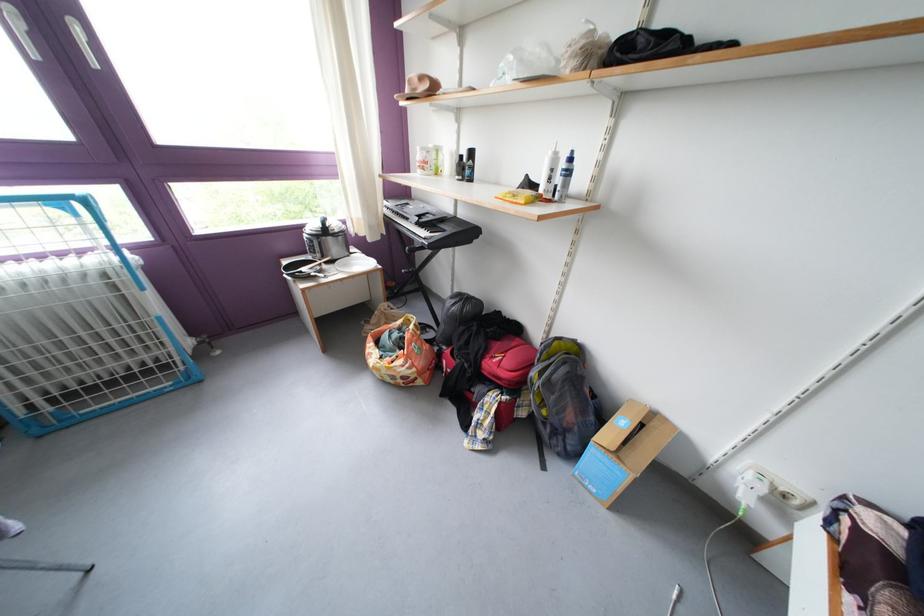
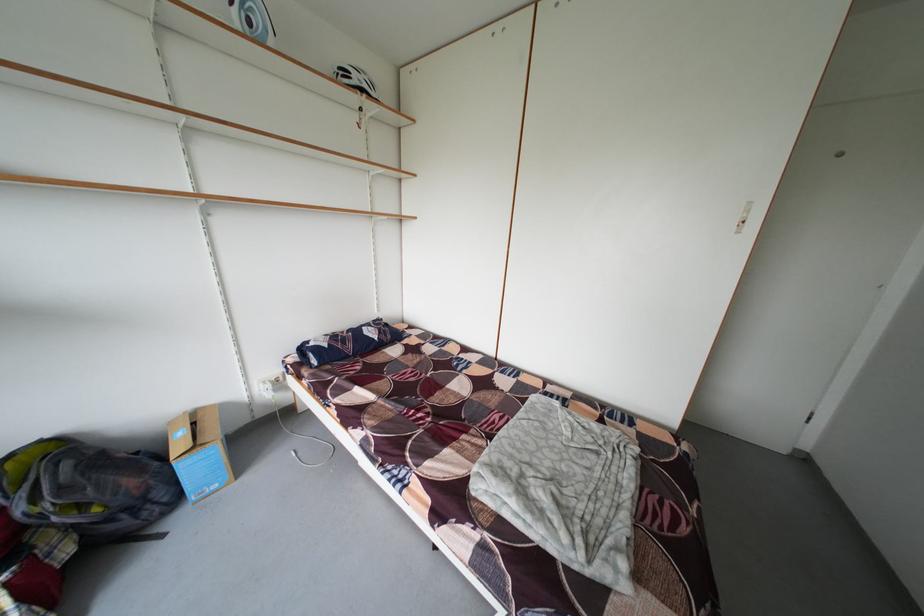
Where in the second image is the point corresponding to (641,407) from the first image?

(181, 428)